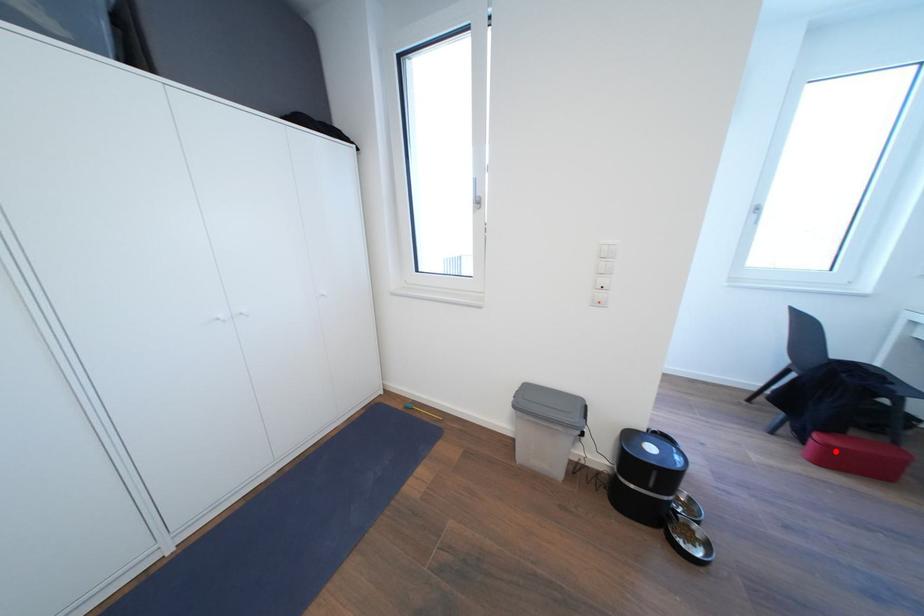
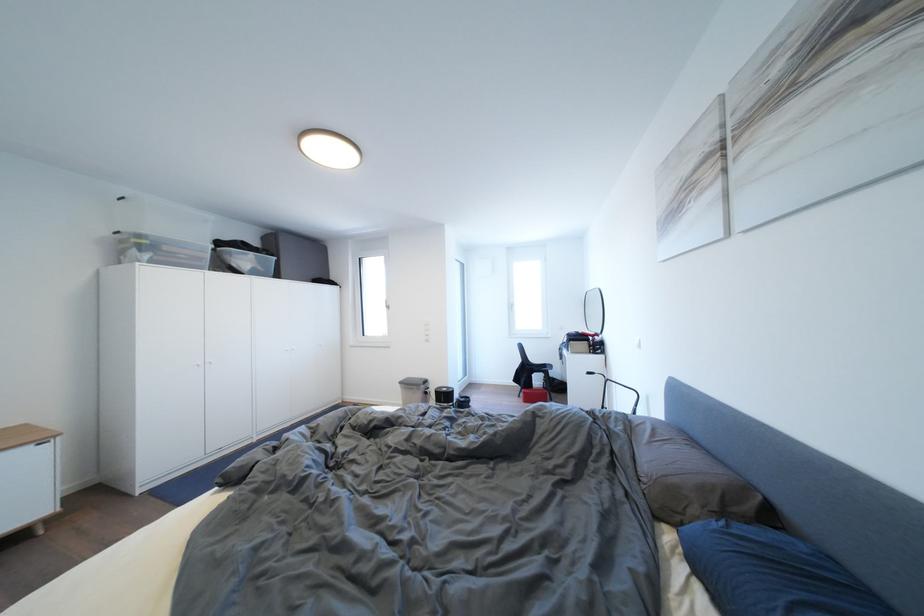
In the second image, find the point that corresponds to the highlighted location in the first image.

(532, 398)